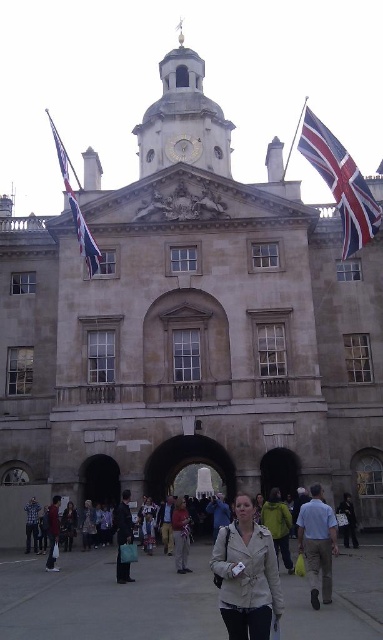
You are an art student observing the grand historic building. You notice two jackets displayed at the center of the building. Which one is taller, the light beige leather jacket at center or the light beige jacket at center?

The light beige leather jacket at center is much taller as light beige jacket at center.